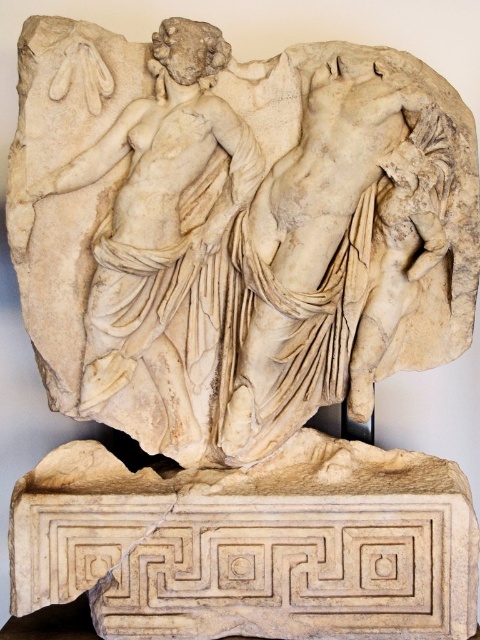
Is white marble torso at center bigger than white marble statue at left?

No, white marble torso at center is not bigger than white marble statue at left.

Does white marble torso at center appear over white marble statue at left?

Incorrect, white marble torso at center is not positioned above white marble statue at left.

This screenshot has height=640, width=480. I want to click on white marble torso at center, so click(332, 253).

The height and width of the screenshot is (640, 480). I want to click on white marble torso at center, so click(332, 253).

Does white marble sculpture at center have a greater height compared to white marble torso at center?

Yes, white marble sculpture at center is taller than white marble torso at center.

Image resolution: width=480 pixels, height=640 pixels. I want to click on white marble sculpture at center, so click(x=235, y=230).

Is point (27, 259) positioned behind point (328, 296)?

No, (27, 259) is in front of (328, 296).

Where is `white marble sculpture at center`? white marble sculpture at center is located at coordinates coord(235,230).

Does point (182, 356) come farther from viewer compared to point (183, 228)?

That is True.

Does white marble sculpture at center have a greater height compared to white marble statue at left?

Yes.

Which is in front, point (274, 156) or point (107, 68)?

Positioned in front is point (107, 68).

The width and height of the screenshot is (480, 640). Find the location of `white marble sculpture at center`. white marble sculpture at center is located at coordinates (235, 230).